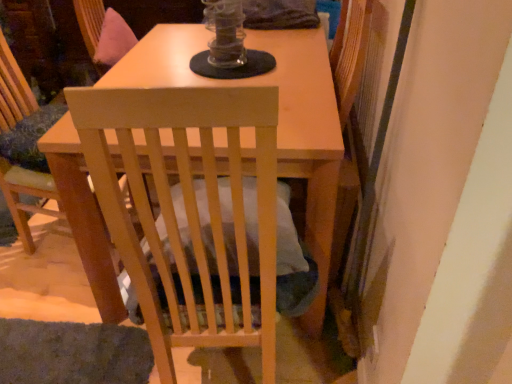
Question: In which direction should I rotate to look at light wood chair at center, the 1th chair when ordered from right to left?

Choices:
 (A) left
 (B) right

Answer: (A)

Question: Is light wood chair at center, the 1th chair from the left, smaller than wooden swivel chair at upper center?

Choices:
 (A) yes
 (B) no

Answer: (B)

Question: From the image's perspective, does light wood chair at center, the 1th chair from the left, appear lower than wooden swivel chair at upper center?

Choices:
 (A) no
 (B) yes

Answer: (B)

Question: Is light wood chair at center, the 1th chair from the left, oriented away from wooden swivel chair at upper center?

Choices:
 (A) no
 (B) yes

Answer: (A)

Question: Is light wood chair at center, placed as the 2th chair when sorted from right to left, touching wooden swivel chair at upper center?

Choices:
 (A) yes
 (B) no

Answer: (B)

Question: Is light wood chair at center, the 1th chair from the left, thinner than wooden swivel chair at upper center?

Choices:
 (A) yes
 (B) no

Answer: (B)

Question: Is light wood chair at center, the 1th chair from the left, outside of wooden swivel chair at upper center?

Choices:
 (A) no
 (B) yes

Answer: (B)

Question: Does light wood chair at center, the 1th chair from the left, appear on the left side of light wood chair at center, the 1th chair when ordered from right to left?

Choices:
 (A) no
 (B) yes

Answer: (B)

Question: From the image's perspective, is light wood chair at center, the 1th chair from the left, located beneath light wood chair at center, positioned as the second chair in left-to-right order?

Choices:
 (A) no
 (B) yes

Answer: (A)

Question: Can you confirm if light wood chair at center, the 1th chair from the left, is bigger than light wood chair at center, positioned as the second chair in left-to-right order?

Choices:
 (A) yes
 (B) no

Answer: (B)

Question: Considering the relative sizes of light wood chair at center, placed as the 2th chair when sorted from right to left, and light wood chair at center, the 1th chair when ordered from right to left, in the image provided, is light wood chair at center, placed as the 2th chair when sorted from right to left, taller than light wood chair at center, the 1th chair when ordered from right to left,?

Choices:
 (A) no
 (B) yes

Answer: (A)

Question: Can you confirm if light wood chair at center, the 1th chair from the left, is thinner than light wood chair at center, positioned as the second chair in left-to-right order?

Choices:
 (A) yes
 (B) no

Answer: (A)

Question: Is the depth of light wood chair at center, placed as the 2th chair when sorted from right to left, less than that of light wood chair at center, positioned as the second chair in left-to-right order?

Choices:
 (A) yes
 (B) no

Answer: (B)

Question: Would you say wooden swivel chair at upper center contains light wood chair at center, the 1th chair when ordered from right to left?

Choices:
 (A) no
 (B) yes

Answer: (A)